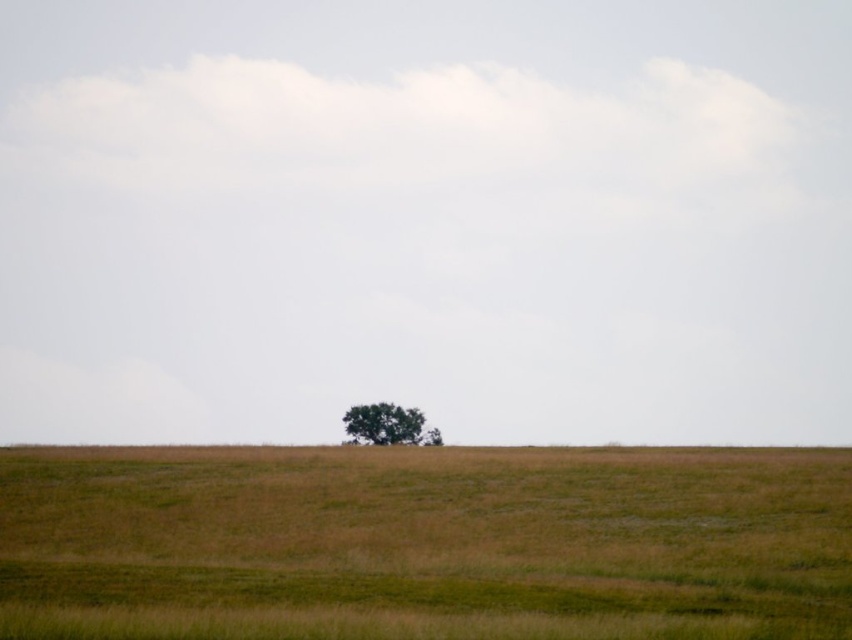
You are a landscape architect designing a new park. You want to place a small bench between the green grass at center and the green leafy tree at center. Based on their widths, which one should the bench be closer to?

The green grass at center has a larger width than the green leafy tree at center. Therefore, the bench should be placed closer to the green leafy tree at center to ensure adequate space for both the grass and the tree.

You are standing at the edge of the field and see the green grass at center and the green leafy tree at center. If you want to reach the tree first, which direction should you walk towards?

The green grass at center and green leafy tree at center are 30.84 meters apart. To reach the green leafy tree at center first, you should walk towards the direction of the green leafy tree at center.

You are standing at the edge of a field and see the green grass at center and the green leafy tree at center. Which one is closer to you?

The green grass at center is closer to you because it is positioned over the green leafy tree at center, indicating it is in the foreground.